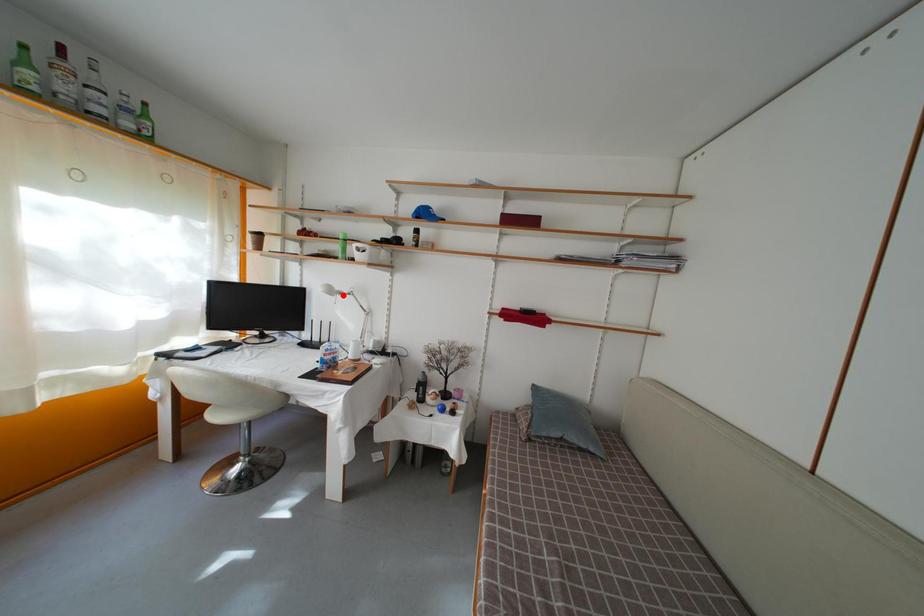
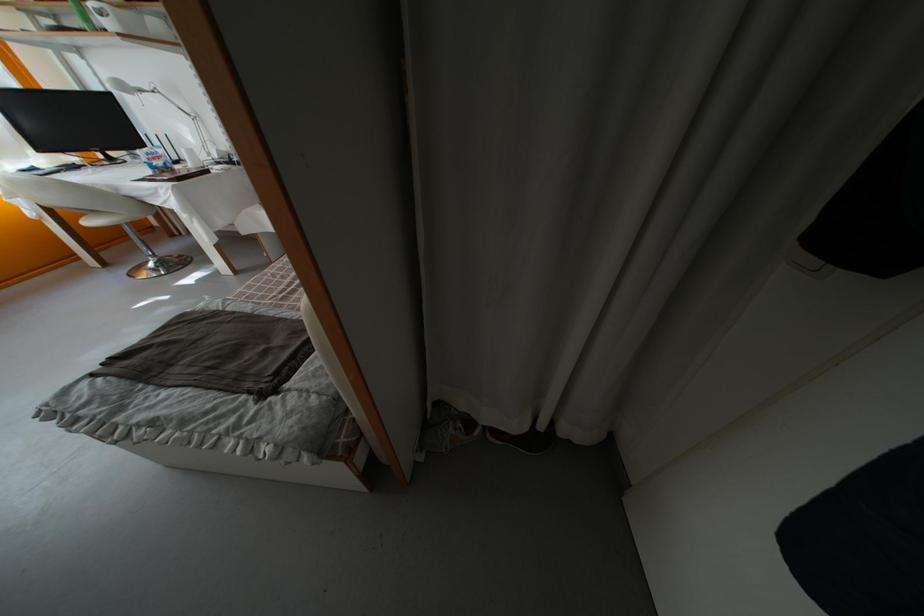
Locate, in the second image, the point that corresponds to the highlighted location in the first image.

(139, 91)